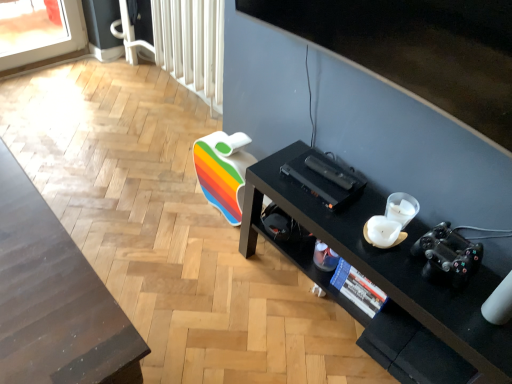
The height and width of the screenshot is (384, 512). Describe the element at coordinates (191, 44) in the screenshot. I see `white plastic radiator at upper center` at that location.

The height and width of the screenshot is (384, 512). Identify the location of shiny dark wood table at lower left. (55, 299).

The image size is (512, 384). Describe the element at coordinates (55, 299) in the screenshot. I see `shiny dark wood table at lower left` at that location.

What do you see at coordinates (448, 255) in the screenshot? I see `black matte video camera at lower right` at bounding box center [448, 255].

Where is `white plastic radiator at upper center`? white plastic radiator at upper center is located at coordinates (191, 44).

Is shiny dark wood table at lower left thinner than black matte video camera at lower right?

In fact, shiny dark wood table at lower left might be wider than black matte video camera at lower right.

Does point (36, 213) come farther from viewer compared to point (450, 232)?

No, it is not.

Does shiny dark wood table at lower left contain black matte video camera at lower right?

Definitely not — black matte video camera at lower right is not inside shiny dark wood table at lower left.

Could you tell me if shiny dark wood table at lower left is turned towards black matte video camera at lower right?

Yes, shiny dark wood table at lower left is turned towards black matte video camera at lower right.

From a real-world perspective, is shiny dark wood table at lower left beneath white plastic radiator at upper center?

Yes, from a real-world perspective, shiny dark wood table at lower left is below white plastic radiator at upper center.

Could white plastic radiator at upper center be considered to be inside shiny dark wood table at lower left?

No.

Is point (94, 290) farther from viewer compared to point (161, 22)?

No.

Who is bigger, shiny dark wood table at lower left or white plastic radiator at upper center?

shiny dark wood table at lower left.

From a real-world perspective, between black matte video camera at lower right and white plastic radiator at upper center, who is vertically higher?

black matte video camera at lower right, from a real-world perspective.

From the image's perspective, which one is positioned higher, black matte video camera at lower right or white plastic radiator at upper center?

From the image's view, white plastic radiator at upper center is above.

Looking at their sizes, would you say black matte video camera at lower right is wider or thinner than white plastic radiator at upper center?

black matte video camera at lower right is thinner than white plastic radiator at upper center.

How many degrees apart are the facing directions of black matte video camera at lower right and white plastic radiator at upper center?

2.57 degrees.

Does black matte desk at lower right come in front of shiny dark wood table at lower left?

No, black matte desk at lower right is behind shiny dark wood table at lower left.

Would you say black matte desk at lower right is inside or outside shiny dark wood table at lower left?

black matte desk at lower right exists outside the volume of shiny dark wood table at lower left.

Is black matte desk at lower right facing towards shiny dark wood table at lower left?

Yes, black matte desk at lower right faces towards shiny dark wood table at lower left.

Is black matte video camera at lower right bigger than shiny dark wood table at lower left?

Actually, black matte video camera at lower right might be smaller than shiny dark wood table at lower left.

From the image's perspective, is black matte video camera at lower right located above or below shiny dark wood table at lower left?

black matte video camera at lower right is above shiny dark wood table at lower left.

Between black matte video camera at lower right and shiny dark wood table at lower left, which one has more height?

shiny dark wood table at lower left.

Between point (453, 261) and point (61, 330), which one is positioned in front?

Point (61, 330)

Is white plastic radiator at upper center far from shiny dark wood table at lower left?

Yes.

Is white plastic radiator at upper center in front of or behind shiny dark wood table at lower left in the image?

white plastic radiator at upper center is behind shiny dark wood table at lower left.

Can you tell me how much white plastic radiator at upper center and shiny dark wood table at lower left differ in facing direction?

The angle between the facing direction of white plastic radiator at upper center and the facing direction of shiny dark wood table at lower left is 176 degrees.

Looking at the image, does white plastic radiator at upper center seem bigger or smaller compared to shiny dark wood table at lower left?

white plastic radiator at upper center is smaller than shiny dark wood table at lower left.

Where is `desk on the right of white plastic radiator at upper center`? The image size is (512, 384). desk on the right of white plastic radiator at upper center is located at coordinates click(x=386, y=265).

From the image's perspective, is black matte desk at lower right above or below white plastic radiator at upper center?

black matte desk at lower right is situated lower than white plastic radiator at upper center in the image.

Is black matte desk at lower right bigger or smaller than white plastic radiator at upper center?

Considering their sizes, black matte desk at lower right takes up more space than white plastic radiator at upper center.

Consider the image. Considering the positions of objects black matte desk at lower right and white plastic radiator at upper center in the image provided, who is in front, black matte desk at lower right or white plastic radiator at upper center?

black matte desk at lower right.

Locate an element on the screen. This screenshot has width=512, height=384. table in front of the black matte video camera at lower right is located at coordinates (55, 299).

The height and width of the screenshot is (384, 512). Identify the location of table below the white plastic radiator at upper center (from a real-world perspective). (55, 299).

Consider the image. Estimate the real-world distances between objects in this image. Which object is closer to shiny dark wood table at lower left, black matte desk at lower right or white plastic radiator at upper center?

black matte desk at lower right lies closer to shiny dark wood table at lower left than the other object.

Which object lies further to the anchor point white plastic radiator at upper center, black matte video camera at lower right or shiny dark wood table at lower left?

The object further to white plastic radiator at upper center is black matte video camera at lower right.

Looking at the image, which one is located further to white plastic radiator at upper center, shiny dark wood table at lower left or black matte desk at lower right?

shiny dark wood table at lower left is further to white plastic radiator at upper center.

Considering their positions, is white plastic radiator at upper center positioned closer to black matte video camera at lower right than shiny dark wood table at lower left?

shiny dark wood table at lower left lies closer to black matte video camera at lower right than the other object.

When comparing their distances from black matte video camera at lower right, does white plastic radiator at upper center or black matte desk at lower right seem closer?

black matte desk at lower right is positioned closer to the anchor black matte video camera at lower right.

Estimate the real-world distances between objects in this image. Which object is closer to shiny dark wood table at lower left, black matte desk at lower right or black matte video camera at lower right?

black matte desk at lower right is positioned closer to the anchor shiny dark wood table at lower left.

From the image, which object appears to be nearer to shiny dark wood table at lower left, black matte video camera at lower right or black matte desk at lower right?

Among the two, black matte desk at lower right is located nearer to shiny dark wood table at lower left.

Estimate the real-world distances between objects in this image. Which object is further from black matte desk at lower right, black matte video camera at lower right or white plastic radiator at upper center?

Among the two, white plastic radiator at upper center is located further to black matte desk at lower right.

The width and height of the screenshot is (512, 384). Identify the location of video camera that lies between white plastic radiator at upper center and black matte desk at lower right from top to bottom. (448, 255).

Locate an element on the screen. This screenshot has height=384, width=512. desk between shiny dark wood table at lower left and black matte video camera at lower right in the horizontal direction is located at coordinates (386, 265).

At what (x,y) coordinates should I click in order to perform the action: click on radiator located between shiny dark wood table at lower left and black matte video camera at lower right in the left-right direction. Please return your answer as a coordinate pair (x, y). This screenshot has width=512, height=384. Looking at the image, I should click on (191, 44).

The image size is (512, 384). I want to click on desk between white plastic radiator at upper center and shiny dark wood table at lower left in the vertical direction, so click(386, 265).